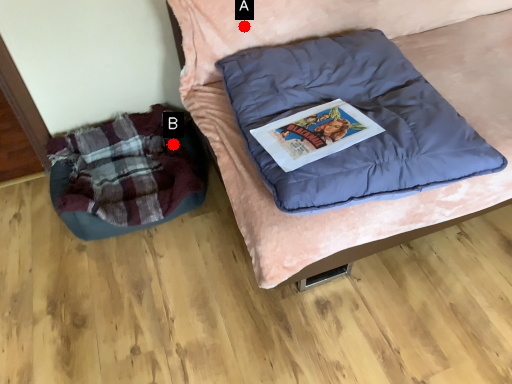
Question: Two points are circled on the image, labeled by A and B beside each circle. Which point is further to the camera?

Choices:
 (A) A is further
 (B) B is further

Answer: (B)